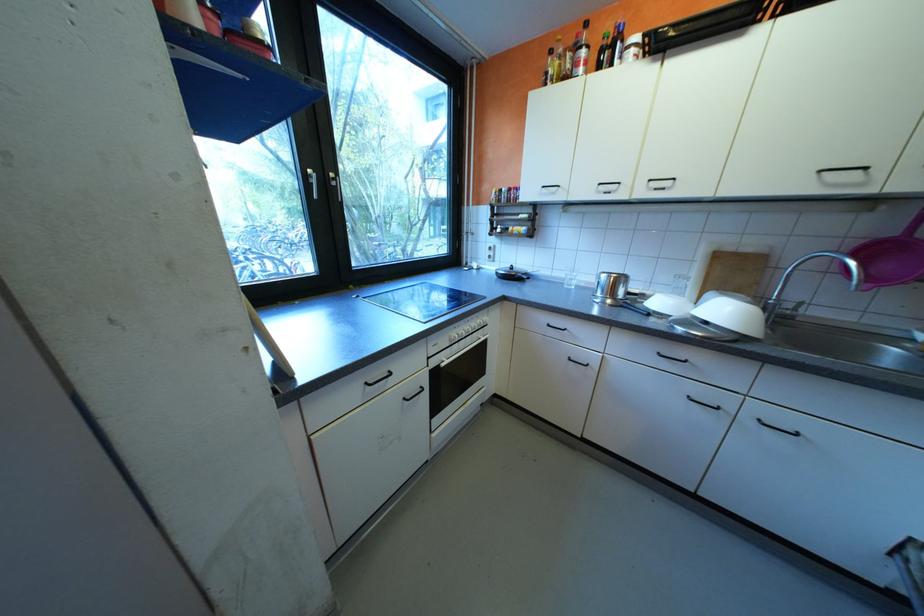
The image size is (924, 616). Describe the element at coordinates (465, 350) in the screenshot. I see `the white oven handle` at that location.